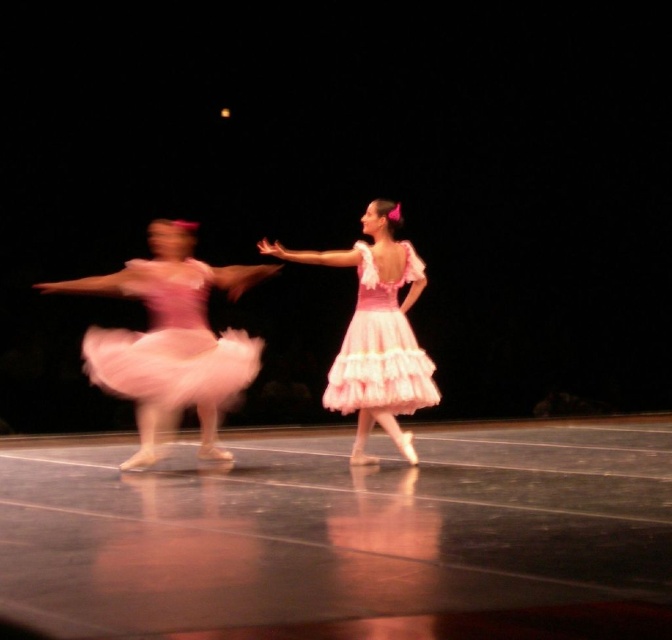
Question: In this image, where is matte pink tulle dress at left located relative to matte pink tulle dress at center?

Choices:
 (A) left
 (B) right

Answer: (A)

Question: Among these objects, which one is nearest to the camera?

Choices:
 (A) matte pink tutu at center
 (B) matte pink tulle dress at left
 (C) matte pink tulle dress at center
 (D) matte pink tutu at left

Answer: (D)

Question: Among these objects, which one is farthest from the camera?

Choices:
 (A) matte pink tulle dress at left
 (B) matte pink tutu at center
 (C) matte pink tutu at left

Answer: (B)

Question: Does matte pink tutu at center come in front of matte pink tulle dress at center?

Choices:
 (A) no
 (B) yes

Answer: (B)

Question: Is matte pink tutu at left above matte pink tulle dress at center?

Choices:
 (A) no
 (B) yes

Answer: (A)

Question: Which point appears closest to the camera in this image?

Choices:
 (A) (177, 316)
 (B) (374, 228)
 (C) (403, 339)

Answer: (A)